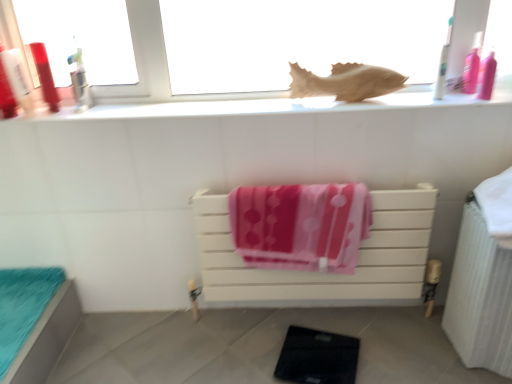
What is the approximate height of pink plastic bottle at upper right, the first toiletry from the right?

7.83 inches.

This screenshot has height=384, width=512. What do you see at coordinates (480, 297) in the screenshot?
I see `white textured radiator at right` at bounding box center [480, 297].

Describe the element at coordinates (257, 106) in the screenshot. The width and height of the screenshot is (512, 384). I see `white ceramic window sill at upper center` at that location.

Identify the location of wooden fish at upper center. (346, 82).

What are the coordinates of `window sill above the white wooden towel rack at center, the second furniture from the left (from a real-world perspective)` in the screenshot? It's located at (257, 106).

How different are the orientations of white wooden towel rack at center, the first furniture positioned from the right, and white ceramic window sill at upper center in degrees?

They differ by 0.53 degrees in their facing directions.

Does white wooden towel rack at center, the second furniture from the left, appear on the left side of white ceramic window sill at upper center?

In fact, white wooden towel rack at center, the second furniture from the left, is to the right of white ceramic window sill at upper center.

Are white wooden towel rack at center, the second furniture from the left, and white ceramic window sill at upper center located far from each other?

white wooden towel rack at center, the second furniture from the left, is near white ceramic window sill at upper center, not far away.

Is teal fabric cushion at lower left, placed as the 1th furniture when sorted from left to right, not near white ceramic window sill at upper center?

No.

Considering the sizes of objects teal fabric cushion at lower left, which is the 2th furniture from right to left, and white ceramic window sill at upper center in the image provided, who is shorter, teal fabric cushion at lower left, which is the 2th furniture from right to left, or white ceramic window sill at upper center?

Standing shorter between the two is white ceramic window sill at upper center.

From a real-world perspective, between teal fabric cushion at lower left, placed as the 1th furniture when sorted from left to right, and white ceramic window sill at upper center, who is vertically lower?

From a 3D spatial view, teal fabric cushion at lower left, placed as the 1th furniture when sorted from left to right, is below.

Does pink fabric beach towel at center appear on the left side of white plastic toothbrush at upper right, the second toiletry viewed from the right?

Indeed, pink fabric beach towel at center is positioned on the left side of white plastic toothbrush at upper right, the second toiletry viewed from the right.

Locate an element on the screen. The image size is (512, 384). the 4th toiletry located above the pink fabric beach towel at center (from a real-world perspective) is located at coordinates point(443,64).

Is pink fabric beach towel at center in contact with white plastic toothbrush at upper right, marked as the third toiletry in a left-to-right arrangement?

No, pink fabric beach towel at center is not next to white plastic toothbrush at upper right, marked as the third toiletry in a left-to-right arrangement.

Do you think pink fabric beach towel at center is within white plastic toothbrush at upper right, marked as the third toiletry in a left-to-right arrangement, or outside of it?

The correct answer is: outside.

Is white wooden towel rack at center, the second furniture from the left, far away from teal fabric cushion at lower left, placed as the 1th furniture when sorted from left to right?

Actually, white wooden towel rack at center, the second furniture from the left, and teal fabric cushion at lower left, placed as the 1th furniture when sorted from left to right, are a little close together.

Considering the sizes of objects white wooden towel rack at center, the second furniture from the left, and teal fabric cushion at lower left, placed as the 1th furniture when sorted from left to right, in the image provided, who is bigger, white wooden towel rack at center, the second furniture from the left, or teal fabric cushion at lower left, placed as the 1th furniture when sorted from left to right,?

Bigger between the two is white wooden towel rack at center, the second furniture from the left.

Consider the image. From the image's perspective, is white wooden towel rack at center, the second furniture from the left, over teal fabric cushion at lower left, placed as the 1th furniture when sorted from left to right?

Yes, from the image's perspective, white wooden towel rack at center, the second furniture from the left, is above teal fabric cushion at lower left, placed as the 1th furniture when sorted from left to right.

Would you say white wooden towel rack at center, the second furniture from the left, is to the left or to the right of teal fabric cushion at lower left, placed as the 1th furniture when sorted from left to right, in the picture?

white wooden towel rack at center, the second furniture from the left, is positioned on teal fabric cushion at lower left, placed as the 1th furniture when sorted from left to right,'s right side.

The width and height of the screenshot is (512, 384). I want to click on radiator that appears below the wooden fish at upper center (from a real-world perspective), so click(480, 297).

Relative to wooden fish at upper center, is white textured radiator at right in front or behind?

Visually, white textured radiator at right is located in front of wooden fish at upper center.

From the image's perspective, which one is positioned higher, white textured radiator at right or wooden fish at upper center?

From the image's view, wooden fish at upper center is above.

From a real-world perspective, which is physically above, white textured radiator at right or wooden fish at upper center?

From a 3D spatial view, wooden fish at upper center is above.

Considering the positions of objects pink plastic bottle at upper right, the first toiletry from the right, and white ceramic window sill at upper center in the image provided, who is more to the right, pink plastic bottle at upper right, the first toiletry from the right, or white ceramic window sill at upper center?

pink plastic bottle at upper right, the first toiletry from the right.

This screenshot has width=512, height=384. What are the coordinates of `window sill below the pink plastic bottle at upper right, the first toiletry from the right (from the image's perspective)` in the screenshot? It's located at (257, 106).

Based on their sizes in the image, would you say pink plastic bottle at upper right, positioned as the fourth toiletry in left-to-right order, is bigger or smaller than white ceramic window sill at upper center?

pink plastic bottle at upper right, positioned as the fourth toiletry in left-to-right order, is smaller than white ceramic window sill at upper center.

Is pink plastic bottle at upper right, positioned as the fourth toiletry in left-to-right order, positioned far away from white ceramic window sill at upper center?

Actually, pink plastic bottle at upper right, positioned as the fourth toiletry in left-to-right order, and white ceramic window sill at upper center are a little close together.

Could you tell me if matte plastic toothbrush at upper left, arranged as the third toiletry when viewed from the right, is turned towards pink fabric beach towel at center?

Yes, matte plastic toothbrush at upper left, arranged as the third toiletry when viewed from the right, is turned towards pink fabric beach towel at center.

Can you confirm if matte plastic toothbrush at upper left, arranged as the third toiletry when viewed from the right, is taller than pink fabric beach towel at center?

No.

Considering the points (45, 82) and (328, 265), which point is in front, point (45, 82) or point (328, 265)?

The point (45, 82) is closer to the camera.

In the scene shown: Considering the positions of objects matte plastic toothbrush at upper left, arranged as the third toiletry when viewed from the right, and pink fabric beach towel at center in the image provided, who is behind, matte plastic toothbrush at upper left, arranged as the third toiletry when viewed from the right, or pink fabric beach towel at center?

Positioned behind is matte plastic toothbrush at upper left, arranged as the third toiletry when viewed from the right.

The height and width of the screenshot is (384, 512). What are the coordinates of `window sill on the left of white wooden towel rack at center, the first furniture positioned from the right` in the screenshot? It's located at point(257,106).

This screenshot has width=512, height=384. Identify the location of furniture in front of the white ceramic window sill at upper center. (35, 321).

Looking at the image, which one is located further to wooden fish at upper center, white wooden towel rack at center, the first furniture positioned from the right, or white ceramic window sill at upper center?

Based on the image, white wooden towel rack at center, the first furniture positioned from the right, appears to be further to wooden fish at upper center.

In the scene shown: Estimate the real-world distances between objects in this image. Which object is closer to matte plastic toothbrush at upper left, which ranks as the 2th toiletry in left-to-right order, white textured radiator at right or white ceramic window sill at upper center?

The object closer to matte plastic toothbrush at upper left, which ranks as the 2th toiletry in left-to-right order, is white ceramic window sill at upper center.

Based on their spatial positions, is white plastic toothbrush at upper right, marked as the third toiletry in a left-to-right arrangement, or wooden fish at upper center further from wooden fish at upper center?

white plastic toothbrush at upper right, marked as the third toiletry in a left-to-right arrangement.

In the scene shown: Looking at the image, which one is located closer to wooden fish at upper center, white wooden towel rack at center, the second furniture from the left, or white plastic toothbrush at upper right, marked as the third toiletry in a left-to-right arrangement?

Among the two, white plastic toothbrush at upper right, marked as the third toiletry in a left-to-right arrangement, is located nearer to wooden fish at upper center.

Based on their spatial positions, is wooden fish at upper center or white ceramic window sill at upper center closer to white wooden towel rack at center, the second furniture from the left?

Among the two, white ceramic window sill at upper center is located nearer to white wooden towel rack at center, the second furniture from the left.

From the image, which object appears to be nearer to teal fabric cushion at lower left, placed as the 1th furniture when sorted from left to right, white wooden towel rack at center, the first furniture positioned from the right, or white plastic toothbrush at upper right, marked as the third toiletry in a left-to-right arrangement?

white wooden towel rack at center, the first furniture positioned from the right, lies closer to teal fabric cushion at lower left, placed as the 1th furniture when sorted from left to right, than the other object.

Considering their positions, is wooden fish at upper center positioned further to pink plastic bottle at upper right, the first toiletry from the right, than white plastic toothbrush at upper right, marked as the third toiletry in a left-to-right arrangement?

Among the two, wooden fish at upper center is located further to pink plastic bottle at upper right, the first toiletry from the right.

Considering their positions, is white ceramic window sill at upper center positioned further to wooden fish at upper center than pink plastic bottle at upper right, positioned as the fourth toiletry in left-to-right order?

pink plastic bottle at upper right, positioned as the fourth toiletry in left-to-right order, is further to wooden fish at upper center.

In order to click on window sill between matte plastic bottle at left, the 1th toiletry viewed from the left, and teal fabric cushion at lower left, which is the 2th furniture from right to left, in the up-down direction in this screenshot , I will do `click(257, 106)`.

Identify the location of window sill between wooden fish at upper center and teal fabric cushion at lower left, placed as the 1th furniture when sorted from left to right, in the up-down direction. Image resolution: width=512 pixels, height=384 pixels. (257, 106).

This screenshot has width=512, height=384. Find the location of `animal between pink plastic bottle at upper right, the first toiletry from the right, and pink fabric beach towel at center in the up-down direction`. animal between pink plastic bottle at upper right, the first toiletry from the right, and pink fabric beach towel at center in the up-down direction is located at coordinates (346, 82).

The width and height of the screenshot is (512, 384). Identify the location of beach towel between matte plastic toothbrush at upper left, which ranks as the 2th toiletry in left-to-right order, and white wooden towel rack at center, the first furniture positioned from the right. (301, 225).